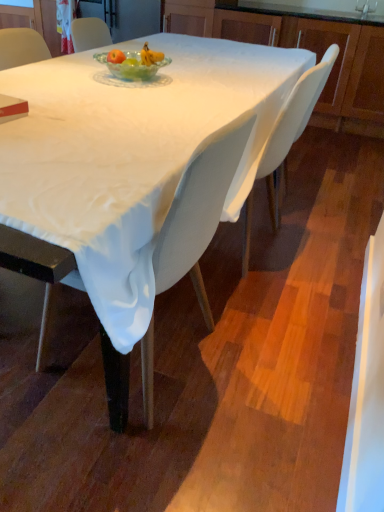
Locate an element on the screen. This screenshot has height=512, width=384. vacant area that is in front of translucent glass bowl at center is located at coordinates (122, 92).